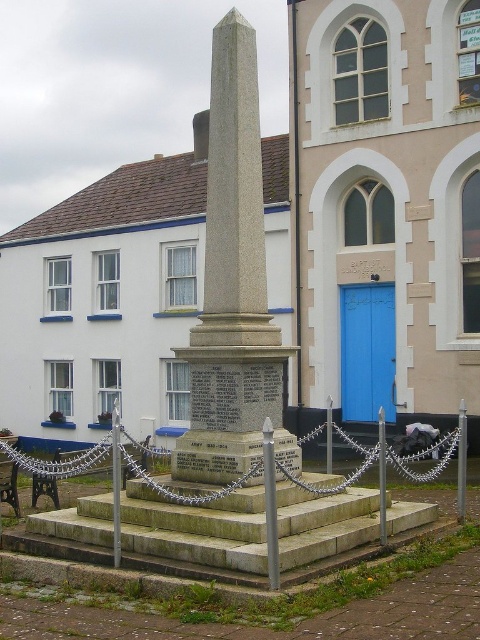
Question: Considering the relative positions of granite obelisk at center and gray stone stairs at center in the image provided, where is granite obelisk at center located with respect to gray stone stairs at center?

Choices:
 (A) left
 (B) right

Answer: (A)

Question: Can you confirm if granite obelisk at center is thinner than gray stone stairs at center?

Choices:
 (A) yes
 (B) no

Answer: (A)

Question: Which point is closer to the camera?

Choices:
 (A) (235, 314)
 (B) (216, 564)

Answer: (B)

Question: Is granite obelisk at center positioned behind gray stone stairs at center?

Choices:
 (A) no
 (B) yes

Answer: (B)